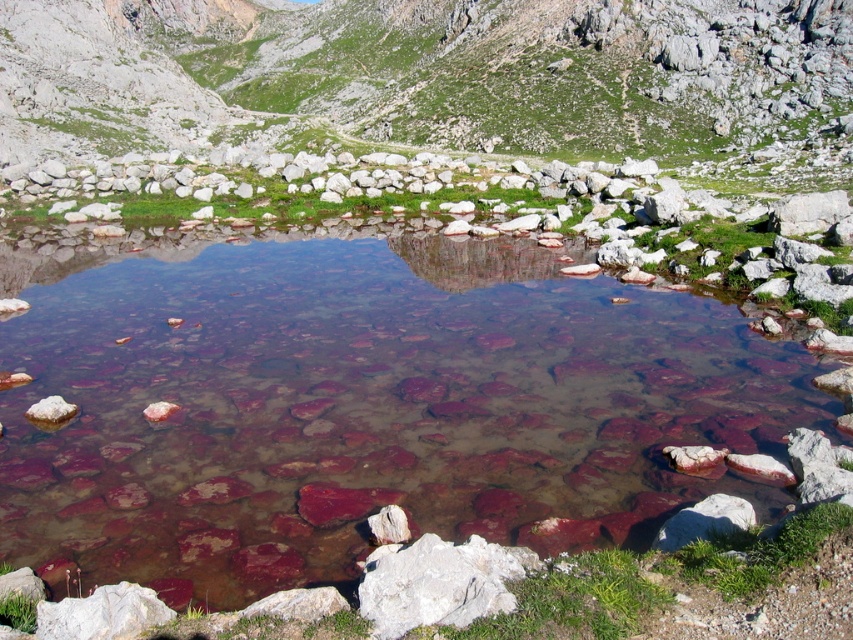
Question: Which is nearer to the clear glass water at center?

Choices:
 (A) reddish-brown rock at lower left
 (B) white smooth rock at lower right
 (C) green grassy hillside at upper center

Answer: (A)

Question: Is the position of green grassy hillside at upper center less distant than that of white smooth rock at lower right?

Choices:
 (A) yes
 (B) no

Answer: (B)

Question: Does clear glass water at center appear on the right side of green grassy hillside at upper center?

Choices:
 (A) yes
 (B) no

Answer: (A)

Question: Which object is the closest to the green grassy hillside at upper center?

Choices:
 (A) white smooth rock at lower right
 (B) clear glass water at center
 (C) reddish-brown rock at lower left
 (D) white rough rock at center

Answer: (B)

Question: Estimate the real-world distances between objects in this image. Which object is farther from the green grassy hillside at upper center?

Choices:
 (A) reddish-brown rock at lower left
 (B) white rough rock at center

Answer: (A)

Question: Does white rough rock at center appear under white smooth rock at lower right?

Choices:
 (A) yes
 (B) no

Answer: (A)